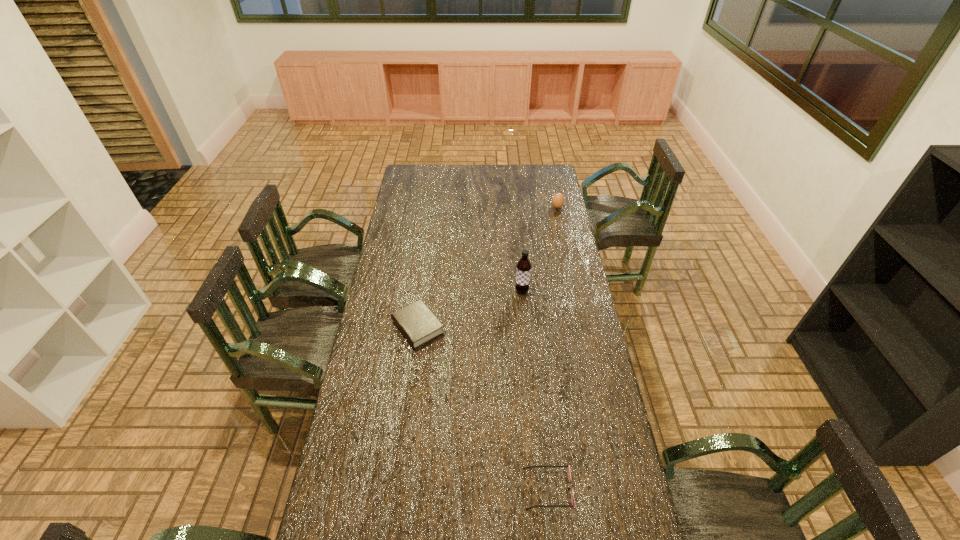
Locate an element on the screen. The image size is (960, 540). vacant space located on the front of the leftmost object is located at coordinates (410, 387).

Identify the location of free location located 0.340m on the bridge of the sunglasses. (412, 489).

Locate an element on the screen. This screenshot has width=960, height=540. vacant space located on the bridge of the sunglasses is located at coordinates (504, 489).

In order to click on vacant position located on the bridge of the sunglasses in this screenshot , I will do `click(432, 489)`.

Find the location of a particular element. Image resolution: width=960 pixels, height=540 pixels. object positioned at the left edge is located at coordinates (417, 323).

Image resolution: width=960 pixels, height=540 pixels. Identify the location of object located in the right edge section of the desktop. (558, 200).

In the image, there is a desktop. At what (x,y) coordinates should I click in order to perform the action: click on vacant space at the far edge. Please return your answer as a coordinate pair (x, y). Looking at the image, I should click on (464, 168).

Locate an element on the screen. This screenshot has width=960, height=540. vacant space at the left edge of the desktop is located at coordinates click(379, 471).

The image size is (960, 540). I want to click on free point at the right edge, so click(598, 429).

In order to click on vacant area at the far left corner of the desktop in this screenshot , I will do coord(405,180).